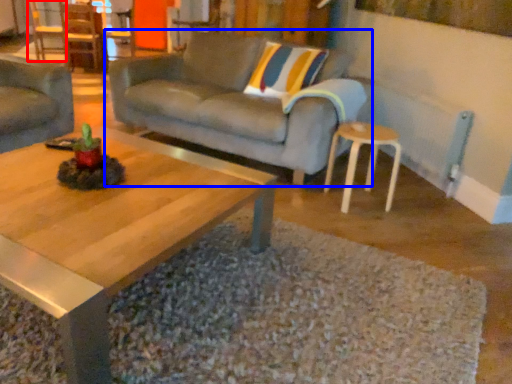
Question: Which object appears closest to the camera in this image, chair (highlighted by a red box) or studio couch (highlighted by a blue box)?

Choices:
 (A) chair
 (B) studio couch

Answer: (B)